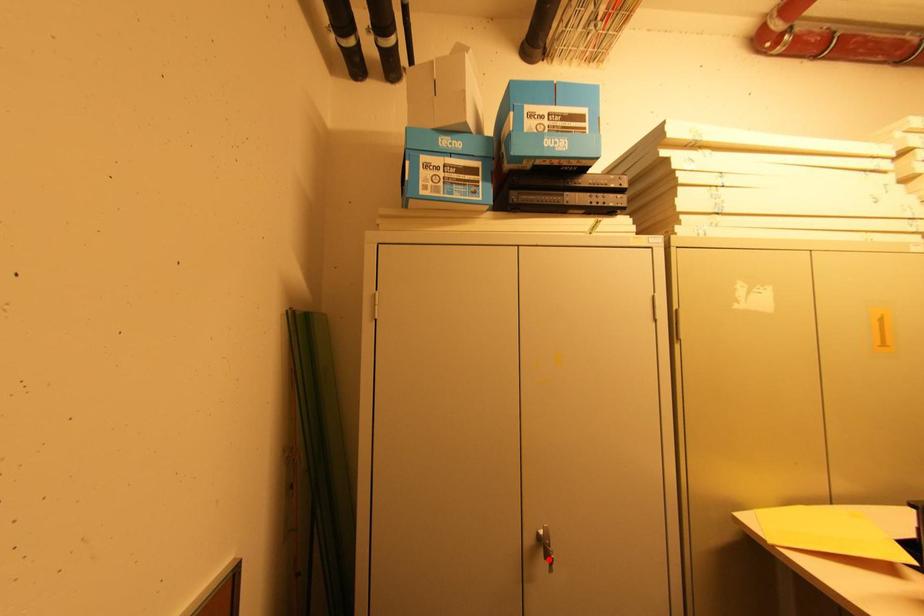
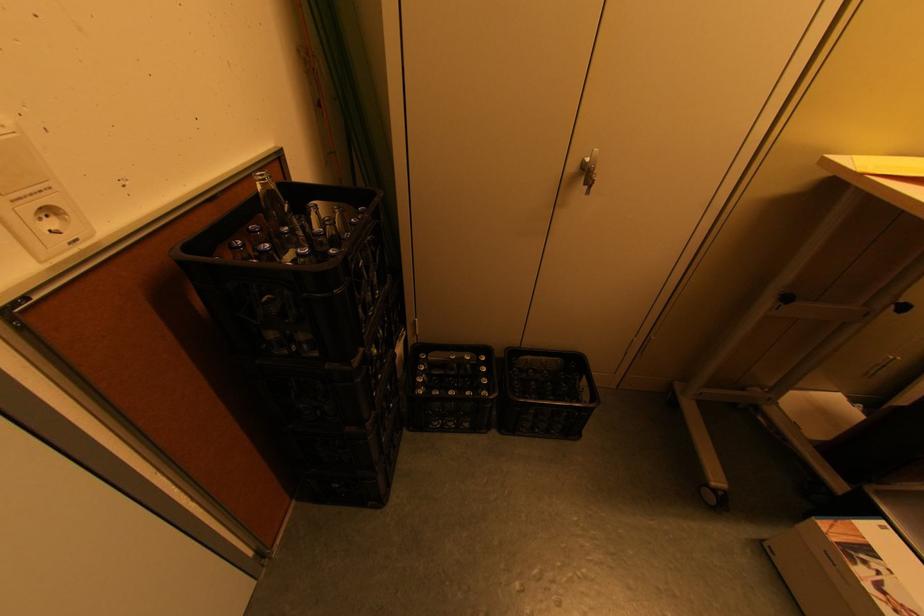
In the second image, find the point that corresponds to the highlighted location in the first image.

(588, 185)